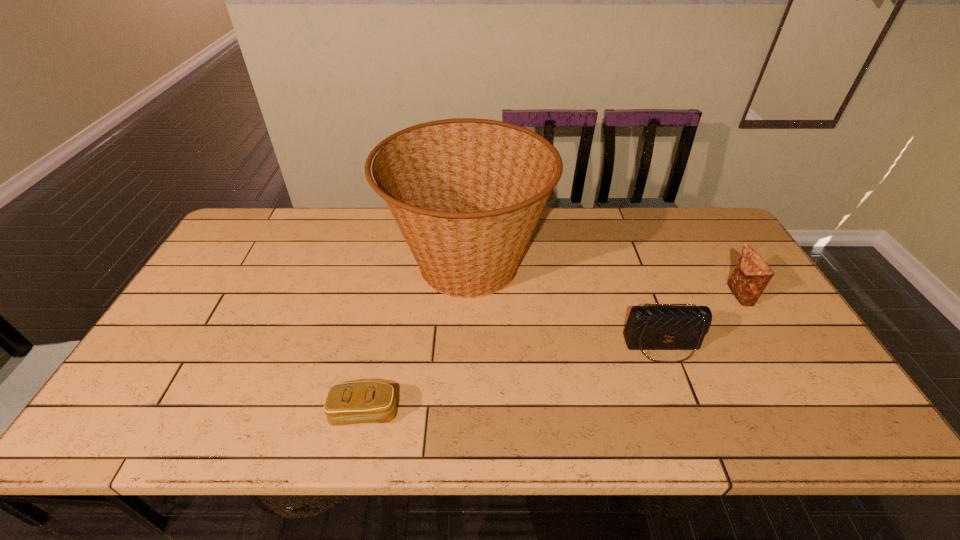
This screenshot has width=960, height=540. In order to click on basket in this screenshot , I will do `click(467, 194)`.

Find the location of a particular element. the rightmost clutch bag is located at coordinates (752, 274).

Find the location of a particular element. the second tallest object is located at coordinates (752, 274).

Locate an element on the screen. The width and height of the screenshot is (960, 540). the third object from left to right is located at coordinates (666, 327).

This screenshot has height=540, width=960. What are the coordinates of `the second tallest clutch bag` in the screenshot? It's located at (666, 327).

Locate an element on the screen. This screenshot has width=960, height=540. the shortest object is located at coordinates (364, 402).

Identify the location of the nearest clutch bag. (364, 402).

At what (x,y) coordinates should I click in order to perform the action: click on vacant space located 0.130m on the right of the basket. Please return your answer as a coordinate pair (x, y). Image resolution: width=960 pixels, height=540 pixels. Looking at the image, I should click on (590, 264).

Identify the location of free spot located on the open side of the farthest clutch bag. This screenshot has width=960, height=540. (644, 295).

Locate an element on the screen. vacant region located on the open side of the farthest clutch bag is located at coordinates (640, 295).